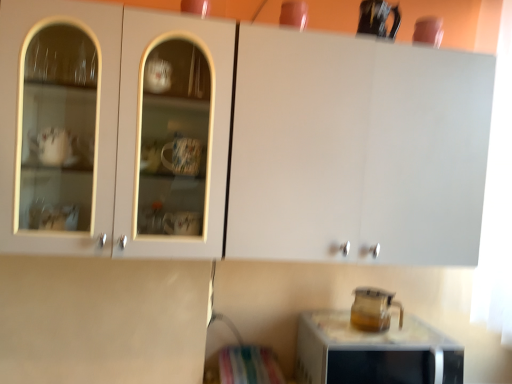
Where is `free space to the right of transparent glass pitcher at lower right`? The width and height of the screenshot is (512, 384). free space to the right of transparent glass pitcher at lower right is located at coordinates (423, 342).